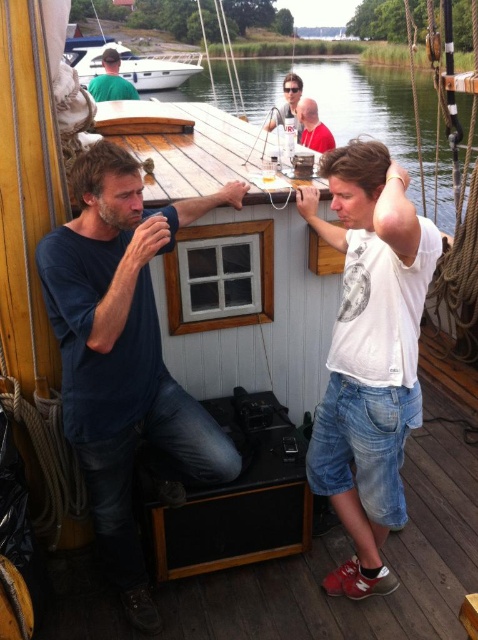
You are standing on the dock and see the white glossy boat at upper center. If you want to throw a small ball to someone on the boat, and the ball can travel up to 8 meters, will you be able to reach them?

The white glossy boat at upper center is 7.60 meters away from the viewer. Since the ball can travel up to 8 meters, you will be able to reach them.